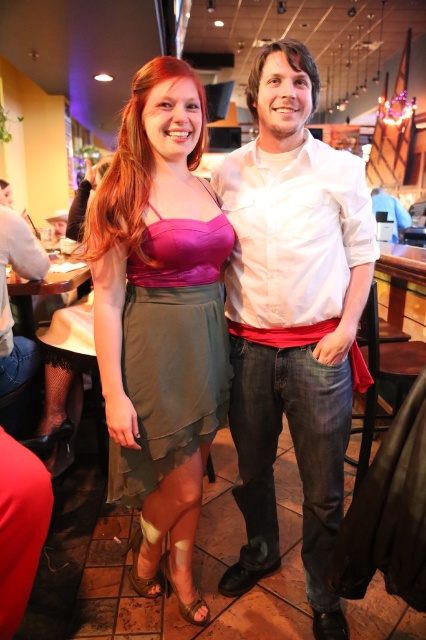
Question: Is satin pink top at center thinner than satin green skirt at center?

Choices:
 (A) no
 (B) yes

Answer: (A)

Question: Can you confirm if satin pink top at center is smaller than satin green skirt at center?

Choices:
 (A) yes
 (B) no

Answer: (B)

Question: Estimate the real-world distances between objects in this image. Which object is closer to the satin pink top at center?

Choices:
 (A) white cotton shirt at center
 (B) satin green skirt at center

Answer: (B)

Question: Which object appears closest to the camera in this image?

Choices:
 (A) satin green skirt at center
 (B) white cotton shirt at center
 (C) satin pink top at center

Answer: (C)

Question: Is the position of satin pink top at center less distant than that of satin green skirt at center?

Choices:
 (A) no
 (B) yes

Answer: (B)

Question: Which point appears farthest from the camera in this image?

Choices:
 (A) (108, 403)
 (B) (270, 396)
 (C) (186, 320)

Answer: (B)